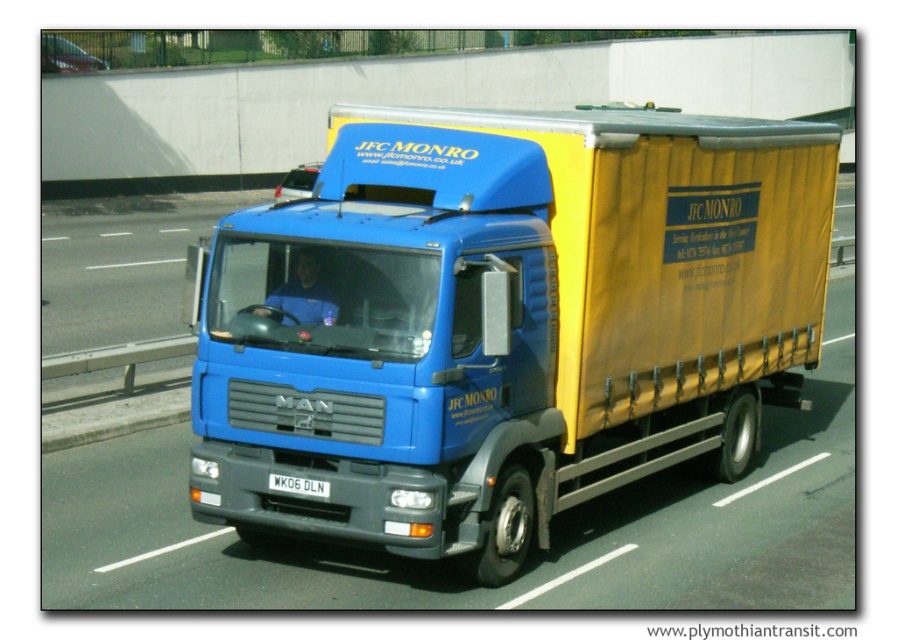
Is blue matte truck at center bigger than white plastic license plate at center?

Yes, blue matte truck at center is bigger than white plastic license plate at center.

Between blue matte truck at center and white plastic license plate at center, which one is positioned higher?

blue matte truck at center is higher up.

This screenshot has width=897, height=640. Describe the element at coordinates (503, 321) in the screenshot. I see `blue matte truck at center` at that location.

Locate an element on the screen. The width and height of the screenshot is (897, 640). blue matte truck at center is located at coordinates (503, 321).